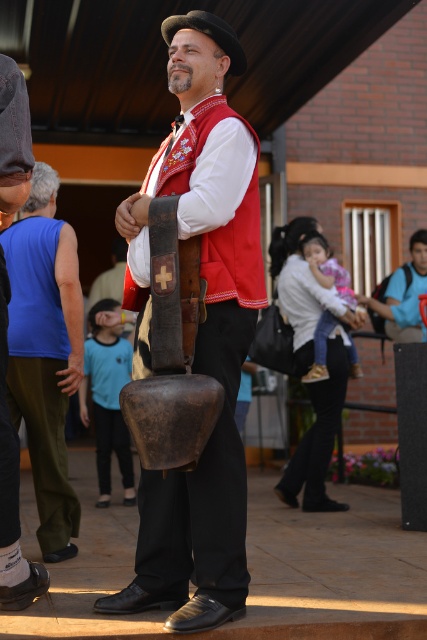
Locate an element on the screen. wooden bell at center is located at coordinates (198, 332).

Is point (205, 332) farther from viewer compared to point (43, 390)?

No.

Locate an element on the screen. The image size is (427, 640). wooden bell at center is located at coordinates (198, 332).